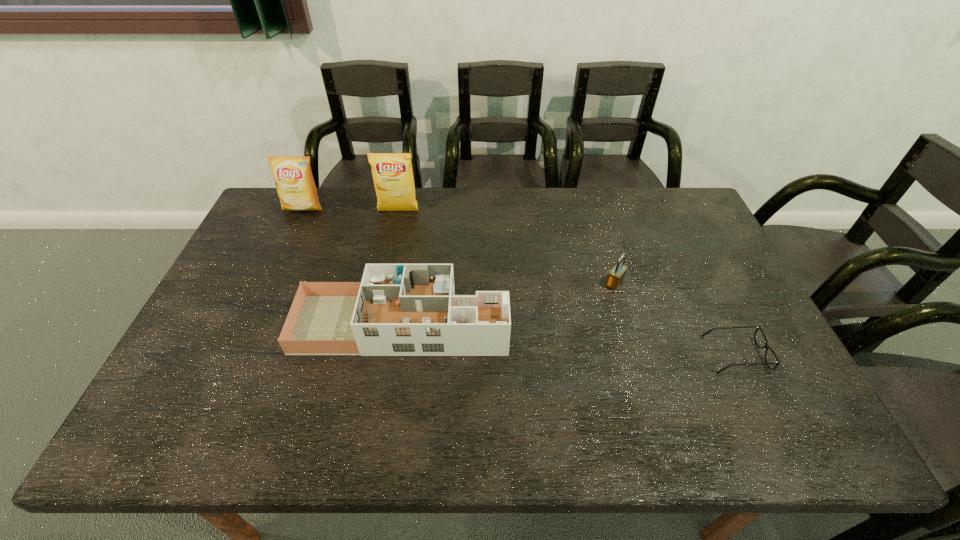
This screenshot has height=540, width=960. What are the coordinates of `the right crisp (potato chip)` in the screenshot? It's located at (392, 173).

Where is `the leftmost object`? This screenshot has width=960, height=540. the leftmost object is located at coordinates pos(295,185).

You are a GUI agent. You are given a task and a screenshot of the screen. Output one action in this format:
    pyautogui.click(x=<x>, y=<y>)
    Task: Click on the shorter crisp (potato chip)
    This screenshot has width=960, height=540.
    Given the screenshot: What is the action you would take?
    pyautogui.click(x=295, y=185)

Find the location of a particular element. Image resolution: width=960 pixels, height=540 pixels. dollhouse is located at coordinates (x=397, y=309).

Image resolution: width=960 pixels, height=540 pixels. I want to click on the fourth object from left to right, so click(616, 276).

Locate an element on the screen. The height and width of the screenshot is (540, 960). the third nearest object is located at coordinates (616, 276).

Identify the location of the shortest object. The height and width of the screenshot is (540, 960). (766, 346).

Identify the location of spectacles. The height and width of the screenshot is (540, 960). (766, 346).

Find the location of a particular element. The image size is (960, 540). free location located 0.220m on the front of the right crisp (potato chip) with the logo is located at coordinates (388, 260).

At what (x,y) coordinates should I click in order to perform the action: click on vacant position located 0.120m on the front-facing side of the fourth shortest object. Please return your answer as a coordinate pair (x, y). This screenshot has height=540, width=960. Looking at the image, I should click on (289, 239).